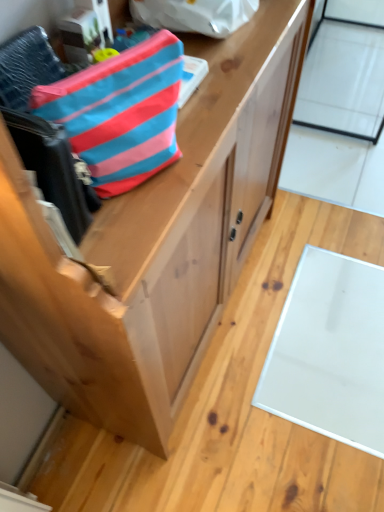
Question: Which direction should I rotate to look at blue striped fabric pouch at upper center, the 2th pouch when ordered from front to back?

Choices:
 (A) right
 (B) left

Answer: (A)

Question: Is transparent glass door at upper right thinner than natural wood cabinet at center?

Choices:
 (A) yes
 (B) no

Answer: (A)

Question: Does transparent glass door at upper right appear on the left side of natural wood cabinet at center?

Choices:
 (A) no
 (B) yes

Answer: (A)

Question: Considering the relative sizes of transparent glass door at upper right and natural wood cabinet at center in the image provided, is transparent glass door at upper right bigger than natural wood cabinet at center?

Choices:
 (A) yes
 (B) no

Answer: (A)

Question: Can you confirm if transparent glass door at upper right is wider than natural wood cabinet at center?

Choices:
 (A) no
 (B) yes

Answer: (A)

Question: Considering the relative sizes of transparent glass door at upper right and natural wood cabinet at center in the image provided, is transparent glass door at upper right shorter than natural wood cabinet at center?

Choices:
 (A) yes
 (B) no

Answer: (B)

Question: Is transparent glass door at upper right facing away from natural wood cabinet at center?

Choices:
 (A) no
 (B) yes

Answer: (A)

Question: Does natural wood cabinet at center have a greater height compared to blue striped fabric pouch at upper center, the 2th pouch positioned from the bottom?

Choices:
 (A) yes
 (B) no

Answer: (A)

Question: Is natural wood cabinet at center to the left of blue striped fabric pouch at upper center, the 1th pouch viewed from the top, from the viewer's perspective?

Choices:
 (A) yes
 (B) no

Answer: (B)

Question: Does natural wood cabinet at center lie behind blue striped fabric pouch at upper center, the 2th pouch when ordered from front to back?

Choices:
 (A) no
 (B) yes

Answer: (B)

Question: From a real-world perspective, is natural wood cabinet at center physically below blue striped fabric pouch at upper center, the 1th pouch viewed from the top?

Choices:
 (A) yes
 (B) no

Answer: (A)

Question: Is natural wood cabinet at center oriented away from blue striped fabric pouch at upper center, the 1th pouch viewed from the top?

Choices:
 (A) yes
 (B) no

Answer: (B)

Question: Does natural wood cabinet at center have a smaller size compared to blue striped fabric pouch at upper center, the 2th pouch positioned from the bottom?

Choices:
 (A) yes
 (B) no

Answer: (B)

Question: Is blue striped fabric pouch at upper left, the 2th pouch in the top-to-bottom sequence, bigger than blue striped fabric pouch at upper center, the 2th pouch positioned from the bottom?

Choices:
 (A) yes
 (B) no

Answer: (A)